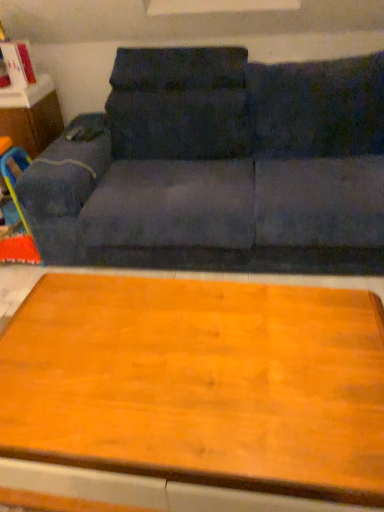
Locate an element on the screen. The width and height of the screenshot is (384, 512). free point above wooden table at lower center (from a real-world perspective) is located at coordinates (180, 349).